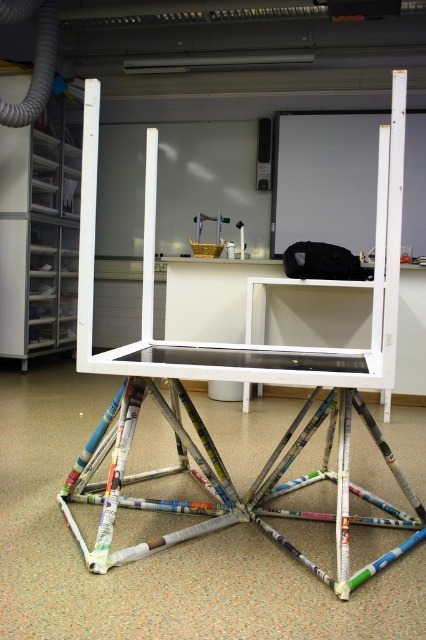
Who is positioned more to the left, white painted wood table at center or white matte easel at upper left?

white matte easel at upper left is more to the left.

Is white painted wood table at center above white matte easel at upper left?

Actually, white painted wood table at center is below white matte easel at upper left.

Is point (189, 444) positioned in front of point (80, 192)?

Yes.

The height and width of the screenshot is (640, 426). I want to click on white painted wood table at center, so click(x=230, y=481).

Is point (8, 276) farther from camera compared to point (230, 296)?

Yes, point (8, 276) is behind point (230, 296).

Is point (54, 212) positioned before point (186, 314)?

No, it is behind (186, 314).

This screenshot has height=640, width=426. What do you see at coordinates (40, 234) in the screenshot?
I see `white matte easel at upper left` at bounding box center [40, 234].

Identify the location of white matte easel at upper left. The height and width of the screenshot is (640, 426). (40, 234).

Is white matte easel at upper left to the left of white matte ladder at center from the viewer's perspective?

Correct, you'll find white matte easel at upper left to the left of white matte ladder at center.

Which is behind, point (22, 218) or point (388, 326)?

The point (22, 218) is more distant.

Who is more forward, (31, 246) or (354, 353)?

Point (354, 353) is more forward.

Identify the location of white matte easel at upper left. (40, 234).